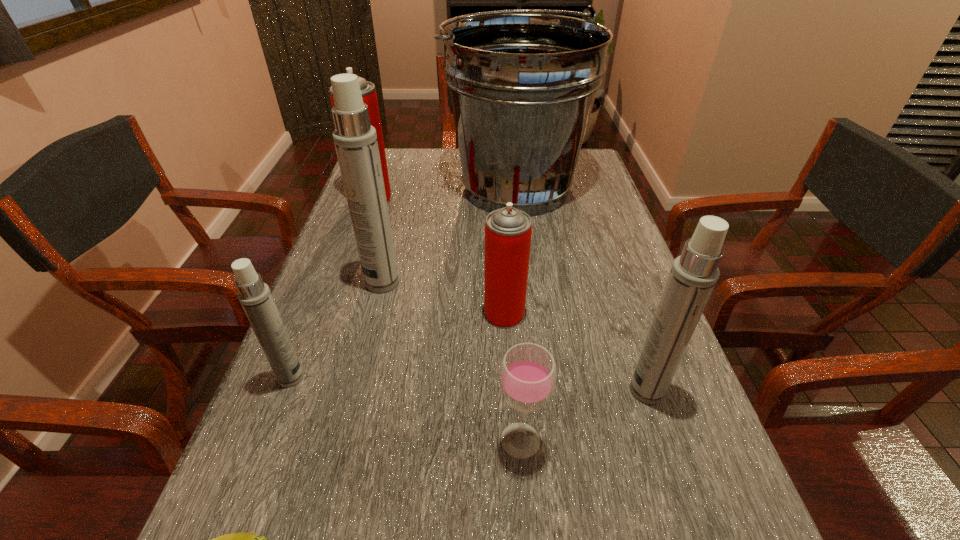
I want to click on bucket at the right edge, so click(522, 85).

The height and width of the screenshot is (540, 960). I want to click on aerosol can that is positioned at the right edge, so click(x=693, y=275).

Locate an element on the screen. object that is at the far right corner is located at coordinates (522, 85).

Locate an element on the screen. Image resolution: width=960 pixels, height=540 pixels. blank space at the far edge is located at coordinates (437, 163).

You are a GUI agent. You are given a task and a screenshot of the screen. Output one action in this format:
    pyautogui.click(x=<x>, y=<y>)
    Task: Click on the vacant point at the left edge
    
    Given the screenshot: What is the action you would take?
    pyautogui.click(x=363, y=338)

In the image, there is a desktop. Find the location of `vacant space at the right edge`. vacant space at the right edge is located at coordinates (576, 207).

Where is `vacant region between the bucket and the second biggest white aerosol can`? vacant region between the bucket and the second biggest white aerosol can is located at coordinates (581, 289).

Image resolution: width=960 pixels, height=540 pixels. Identify the location of vacant region between the farthest white aerosol can and the second aerosol can from right to left. (444, 298).

What are the coordinates of `vacant area that lies between the left red aerosol can and the leftmost white aerosol can` in the screenshot? It's located at (331, 288).

You are a GUI agent. You are given a task and a screenshot of the screen. Output one action in this format:
    pyautogui.click(x=<x>, y=<y>)
    Task: Click on the free space between the rightmost white aerosol can and the wineglass
    This screenshot has width=960, height=540.
    Given the screenshot: What is the action you would take?
    pyautogui.click(x=584, y=415)